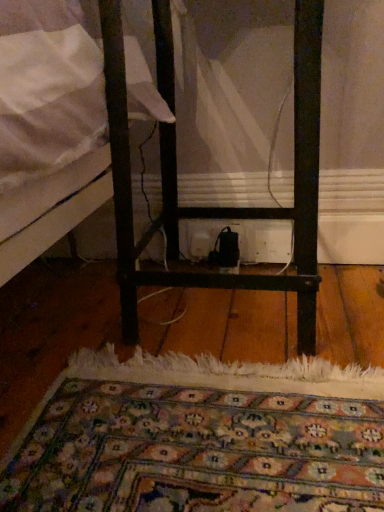
In order to face carpeted rug at center, should I rotate leftwards or rightwards?

It's best to rotate left around 7.586 degrees.

Identify the location of black metal nightstand at center. The width and height of the screenshot is (384, 512). (219, 207).

Where is `carpeted rug at center`? carpeted rug at center is located at coordinates (200, 437).

Does point (299, 228) come closer to viewer compared to point (212, 241)?

Yes, it is in front of point (212, 241).

Locate an element on the screen. electric outlet to the right of black metal nightstand at center is located at coordinates (212, 237).

From the image's perspective, is black metal nightstand at center located above or below white plastic electric outlet at center?

Based on their image positions, black metal nightstand at center is located above white plastic electric outlet at center.

From a real-world perspective, which is physically below, black metal nightstand at center or white plastic electric outlet at center?

From a 3D spatial view, white plastic electric outlet at center is below.

Is carpeted rug at center oriented away from white plastic electric outlet at center?

No.

From a real-world perspective, which is physically below, carpeted rug at center or white plastic electric outlet at center?

carpeted rug at center, from a real-world perspective.

From the image's perspective, is carpeted rug at center under white plastic electric outlet at center?

Yes, from the image's perspective, carpeted rug at center is below white plastic electric outlet at center.

Between carpeted rug at center and white plastic electric outlet at center, which one has larger width?

carpeted rug at center.

Can you confirm if carpeted rug at center is wider than black metal nightstand at center?

Yes.

From the image's perspective, is carpeted rug at center over black metal nightstand at center?

No, from the image's perspective, carpeted rug at center is not above black metal nightstand at center.

Is point (65, 480) closer or farther from the camera than point (156, 229)?

Point (65, 480).

Is white plastic electric outlet at center positioned with its back to carpeted rug at center?

white plastic electric outlet at center does not have its back to carpeted rug at center.

Consider the image. Is white plastic electric outlet at center to the left of carpeted rug at center from the viewer's perspective?

No, white plastic electric outlet at center is not to the left of carpeted rug at center.

How different are the orientations of white plastic electric outlet at center and carpeted rug at center in degrees?

0.823 degrees.

Considering the points (194, 253) and (74, 453), which point is behind, point (194, 253) or point (74, 453)?

The point (194, 253) is behind.

Is white plastic electric outlet at center placed right next to black metal nightstand at center?

→ They are not placed beside each other.

Can you confirm if white plastic electric outlet at center is smaller than black metal nightstand at center?

Yes, white plastic electric outlet at center is smaller than black metal nightstand at center.

Locate an element on the screen. electric outlet lying on the right of black metal nightstand at center is located at coordinates (212, 237).

From a real-world perspective, is white plastic electric outlet at center under black metal nightstand at center?

Yes, from a real-world perspective, white plastic electric outlet at center is below black metal nightstand at center.

Would you say carpeted rug at center is part of black metal nightstand at center's contents?

No, carpeted rug at center is not inside black metal nightstand at center.

How many degrees apart are the facing directions of black metal nightstand at center and carpeted rug at center?

They differ by 0.234 degrees in their facing directions.

Who is bigger, black metal nightstand at center or carpeted rug at center?

black metal nightstand at center.

From a real-world perspective, is black metal nightstand at center positioned over carpeted rug at center based on gravity?

Yes, from a real-world perspective, black metal nightstand at center is above carpeted rug at center.

Locate an element on the screen. This screenshot has height=512, width=384. electric outlet located on the right of black metal nightstand at center is located at coordinates (212, 237).

Locate an element on the screen. electric outlet above the carpeted rug at center (from the image's perspective) is located at coordinates (212, 237).

Looking at this image, which object lies nearer to the anchor point white plastic electric outlet at center, carpeted rug at center or black metal nightstand at center?

black metal nightstand at center is positioned closer to the anchor white plastic electric outlet at center.

From the picture: From the image, which object appears to be nearer to carpeted rug at center, white plastic electric outlet at center or black metal nightstand at center?

Among the two, black metal nightstand at center is located nearer to carpeted rug at center.

Estimate the real-world distances between objects in this image. Which object is further from carpeted rug at center, black metal nightstand at center or white plastic electric outlet at center?

Among the two, white plastic electric outlet at center is located further to carpeted rug at center.

Estimate the real-world distances between objects in this image. Which object is further from white plastic electric outlet at center, black metal nightstand at center or carpeted rug at center?

carpeted rug at center is positioned further to the anchor white plastic electric outlet at center.

Which object lies further to the anchor point black metal nightstand at center, carpeted rug at center or white plastic electric outlet at center?

white plastic electric outlet at center is positioned further to the anchor black metal nightstand at center.

Which object lies nearer to the anchor point black metal nightstand at center, white plastic electric outlet at center or carpeted rug at center?

Among the two, carpeted rug at center is located nearer to black metal nightstand at center.

Where is `furniture between carpeted rug at center and white plastic electric outlet at center in the front-back direction`? The image size is (384, 512). furniture between carpeted rug at center and white plastic electric outlet at center in the front-back direction is located at coordinates (219, 207).